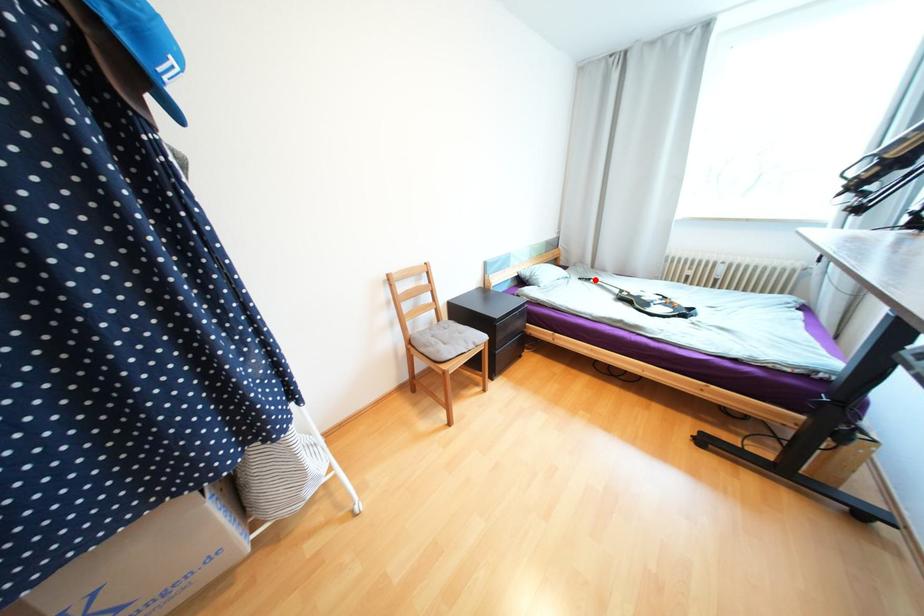
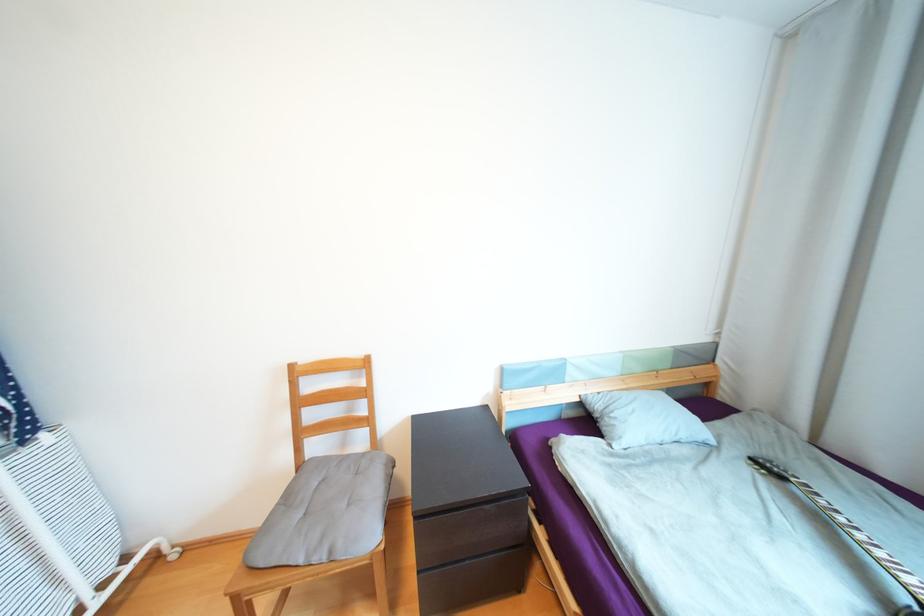
Locate, in the second image, the point that corresponds to the highlighted location in the first image.

(787, 477)